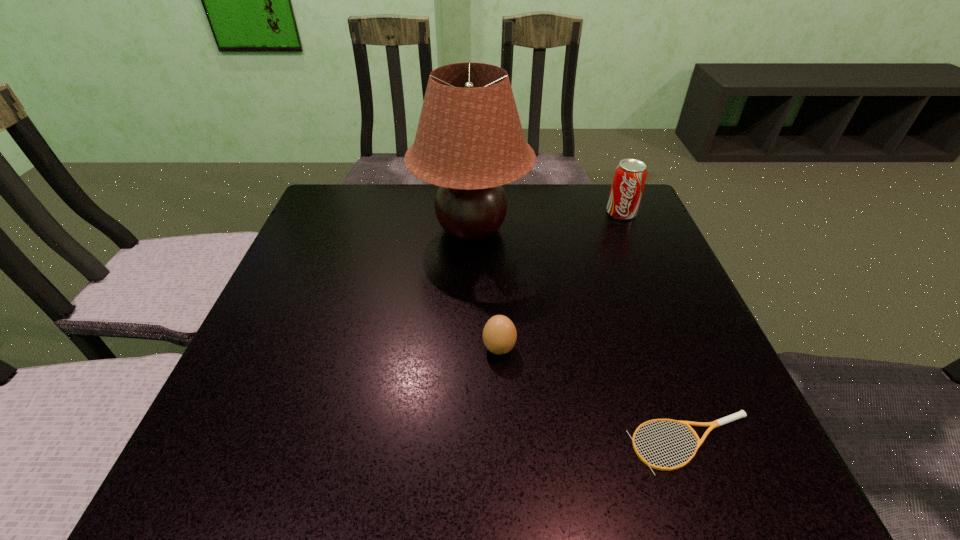
This screenshot has width=960, height=540. In the image, there is a desktop. In order to click on vacant space at the right edge in this screenshot , I will do `click(691, 418)`.

You are a GUI agent. You are given a task and a screenshot of the screen. Output one action in this format:
    pyautogui.click(x=<x>, y=<y>)
    Task: Click on the free space between the lampshade and the soda can
    
    Given the screenshot: What is the action you would take?
    pyautogui.click(x=546, y=221)

Identify the location of unoccupied area between the second shortest object and the second tallest object. (560, 281).

Image resolution: width=960 pixels, height=540 pixels. I want to click on empty space between the nearest object and the soda can, so click(657, 328).

This screenshot has height=540, width=960. Identify the location of free space that is in between the tallest object and the nearest object. (582, 336).

Locate an element on the screen. free space between the second shortest object and the tallest object is located at coordinates (485, 289).

Find the location of a particular element. free space between the tallest object and the nearest object is located at coordinates (582, 336).

The image size is (960, 540). In order to click on vacant space that's between the third farthest object and the second tallest object in this screenshot , I will do `click(560, 281)`.

Locate an element on the screen. Image resolution: width=960 pixels, height=540 pixels. vacant area that lies between the boiled egg and the nearest object is located at coordinates (596, 396).

Locate an element on the screen. The width and height of the screenshot is (960, 540). free space between the shortest object and the lampshade is located at coordinates (582, 336).